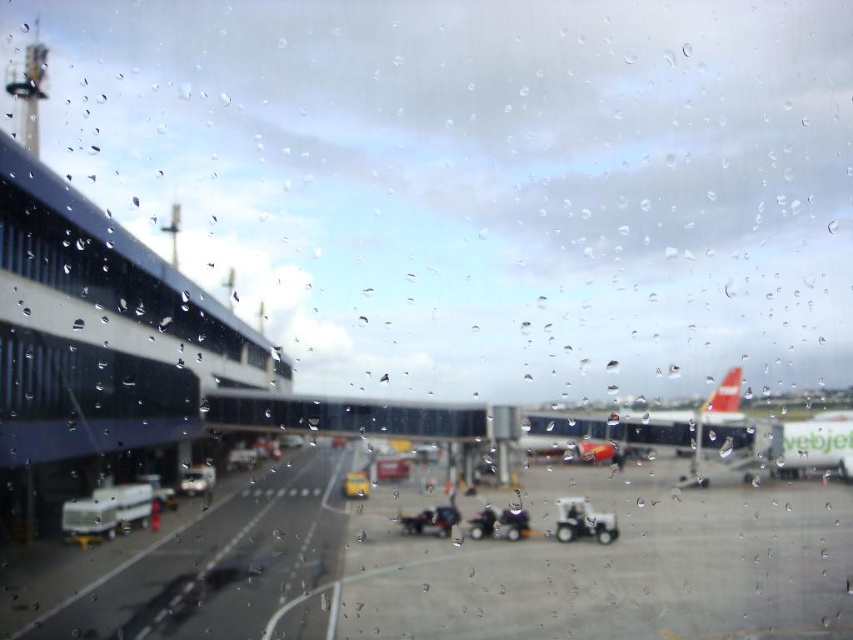
Question: Is smooth asphalt tarmac at center bigger than metallic silver car at lower left?

Choices:
 (A) no
 (B) yes

Answer: (B)

Question: Can you confirm if metallic silver cart at center is bigger than metallic silver car at lower left?

Choices:
 (A) no
 (B) yes

Answer: (B)

Question: Which point is closer to the camera?

Choices:
 (A) (579, 497)
 (B) (212, 476)
 (C) (142, 554)

Answer: (C)

Question: Which point is farther to the camera?

Choices:
 (A) (294, 579)
 (B) (799, 492)
 (C) (527, 518)
 (D) (184, 483)

Answer: (B)

Question: Is metallic silver cart at center closer to the viewer compared to metallic silver car at center?

Choices:
 (A) no
 (B) yes

Answer: (A)

Question: Which point is farther from the camera taking this photo?

Choices:
 (A) (558, 500)
 (B) (236, 566)
 (C) (234, 554)
 (D) (210, 490)

Answer: (D)